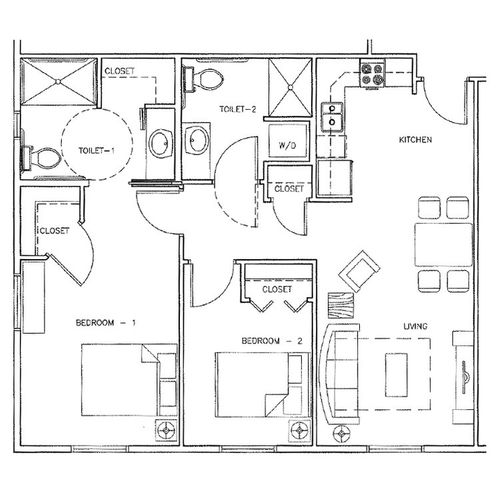
You are a GUI agent. You are given a task and a screenshot of the screen. Output one action in this format:
    pyautogui.click(x=<x>, y=<y>)
    Task: Click on the bed
    The height and width of the screenshot is (500, 500).
    Given the screenshot: What is the action you would take?
    pyautogui.click(x=95, y=360), pyautogui.click(x=139, y=369), pyautogui.click(x=135, y=400), pyautogui.click(x=94, y=400)